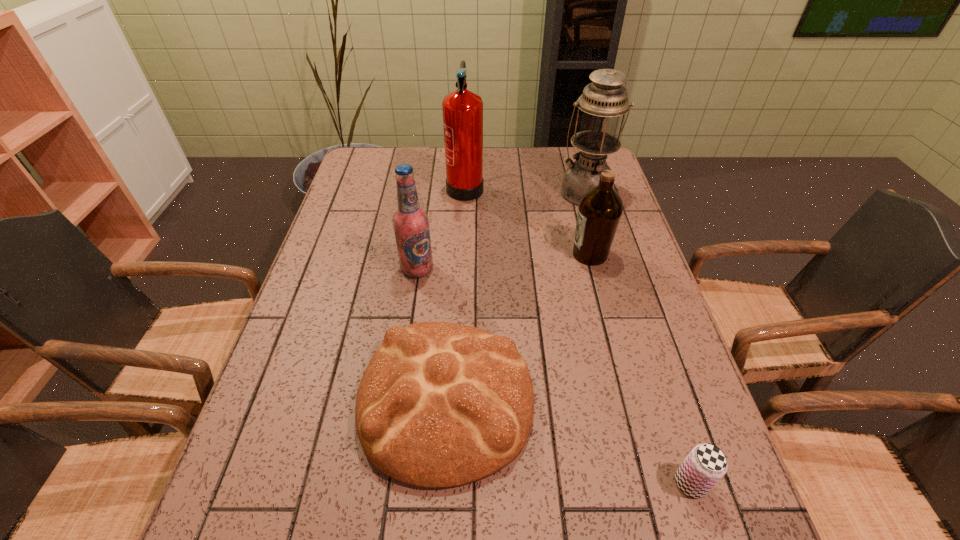
Where is `fire extinguisher`? Image resolution: width=960 pixels, height=540 pixels. fire extinguisher is located at coordinates (462, 109).

Locate an element on the screen. oil lamp is located at coordinates (603, 101).

Where is `the fourth shortest object`? The height and width of the screenshot is (540, 960). the fourth shortest object is located at coordinates (410, 222).

At what (x,y) coordinates should I click in order to perform the action: click on the fourth tallest object. Please return your answer as a coordinate pair (x, y). This screenshot has height=540, width=960. Looking at the image, I should click on (600, 209).

The height and width of the screenshot is (540, 960). Find the location of `bread`. bread is located at coordinates (440, 404).

This screenshot has height=540, width=960. I want to click on the shortest object, so click(x=706, y=464).

The width and height of the screenshot is (960, 540). Find the location of `free spot located on the front of the fire extinguisher`. free spot located on the front of the fire extinguisher is located at coordinates (464, 228).

The image size is (960, 540). What are the coordinates of `blank space located on the front of the oil lamp` in the screenshot? It's located at (614, 288).

The width and height of the screenshot is (960, 540). I want to click on vacant area situated on the left of the alcohol, so click(320, 269).

Locate an element on the screen. The image size is (960, 540). free space located on the label of the fourth tallest object is located at coordinates (435, 254).